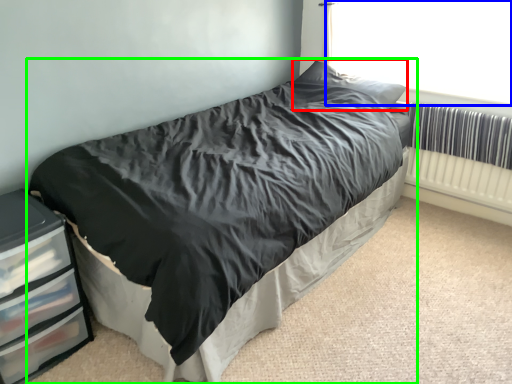
Question: Which is nearer to the pillow (highlighted by a red box)? window screen (highlighted by a blue box) or bed (highlighted by a green box).

Choices:
 (A) window screen
 (B) bed

Answer: (A)